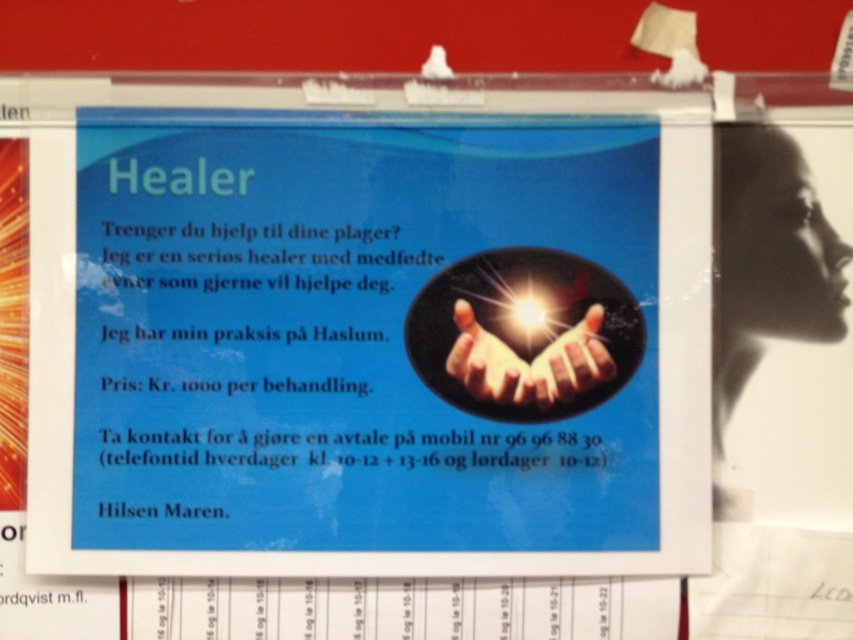
Is shiny golden hands at center below translucent glowing hands at center?

Incorrect, shiny golden hands at center is not positioned below translucent glowing hands at center.

Who is shorter, shiny golden hands at center or translucent glowing hands at center?

Standing shorter between the two is translucent glowing hands at center.

You are a GUI agent. You are given a task and a screenshot of the screen. Output one action in this format:
    pyautogui.click(x=<x>, y=<y>)
    Task: Click on the shiny golden hands at center
    This screenshot has height=640, width=853.
    Given the screenshot: What is the action you would take?
    pyautogui.click(x=527, y=362)

Consider the image. Is translucent glowing hands at center wider than shiny metallic hand at center?

Yes.

Is translucent glowing hands at center taller than shiny metallic hand at center?

Correct, translucent glowing hands at center is much taller as shiny metallic hand at center.

What do you see at coordinates (486, 362) in the screenshot? This screenshot has height=640, width=853. I see `translucent glowing hands at center` at bounding box center [486, 362].

I want to click on translucent glowing hands at center, so click(x=486, y=362).

Is shiny golden hands at center shorter than shiny metallic hand at center?

No.

The image size is (853, 640). What do you see at coordinates (527, 362) in the screenshot?
I see `shiny golden hands at center` at bounding box center [527, 362].

Is point (550, 397) behind point (598, 365)?

Yes, it is behind point (598, 365).

Locate an element on the screen. This screenshot has width=853, height=640. shiny golden hands at center is located at coordinates (527, 362).